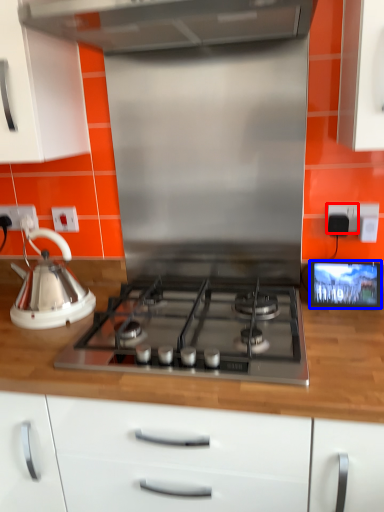
Question: Which point is closer to the camera, electric outlet (highlighted by a red box) or screen (highlighted by a blue box)?

Choices:
 (A) electric outlet
 (B) screen

Answer: (B)